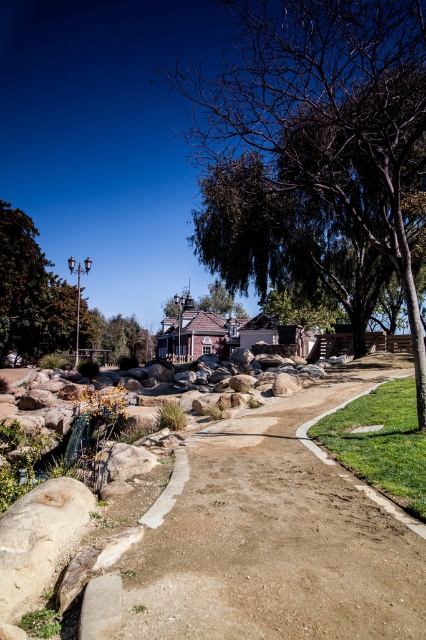
Question: Observing the image, what is the correct spatial positioning of brown dirt track at center in reference to green leafy tree at center?

Choices:
 (A) right
 (B) left

Answer: (A)

Question: Is white rough rock at lower left above green leafy tree at center?

Choices:
 (A) no
 (B) yes

Answer: (A)

Question: Which of the following is the farthest from the observer?

Choices:
 (A) click(17, 301)
 (B) click(219, 292)
 (C) click(132, 566)
 (D) click(354, 216)

Answer: (B)

Question: Which object is positioned closest to the brown textured tree at upper center?

Choices:
 (A) brown dirt track at center
 (B) white rough rock at lower left

Answer: (B)

Question: Does brown dirt track at center have a smaller size compared to brown textured tree at upper center?

Choices:
 (A) yes
 (B) no

Answer: (A)

Question: Which point is farther from the camera taking this photo?

Choices:
 (A) (88, 310)
 (B) (17, 570)
 (C) (414, 189)

Answer: (A)